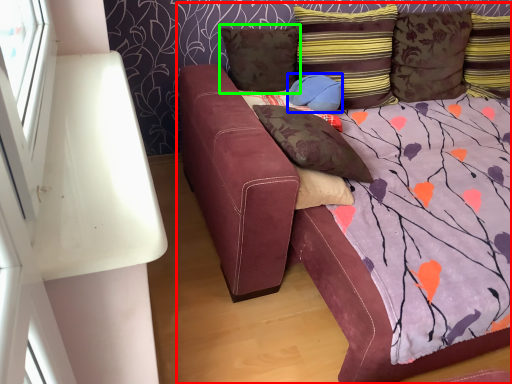
Question: Which is farther away from studio couch (highlighted by a red box)? pillow (highlighted by a blue box) or pillow (highlighted by a green box)?

Choices:
 (A) pillow
 (B) pillow

Answer: (A)